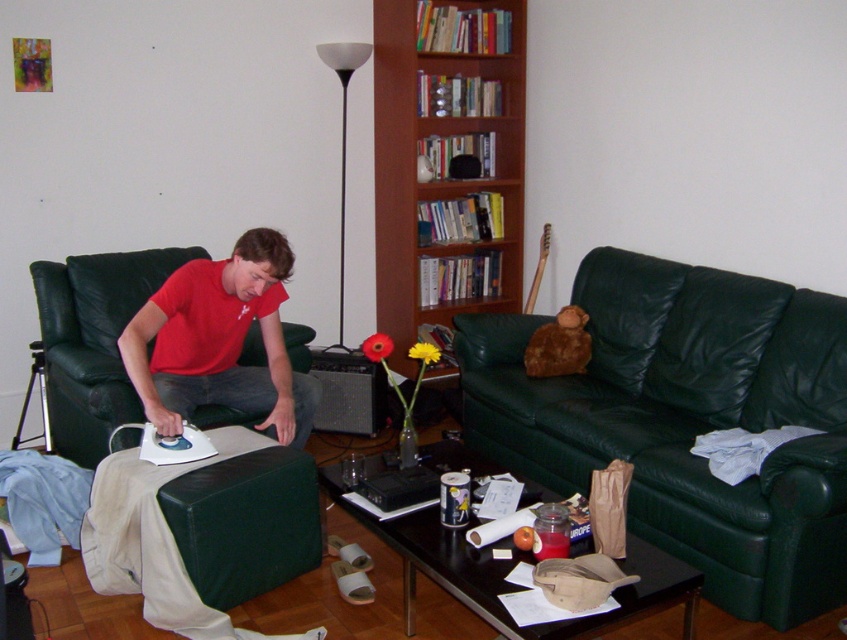
Based on the photo, does green leather couch at center appear over matte red shirt at center?

No.

Between green leather couch at center and matte red shirt at center, which one is positioned lower?

green leather couch at center is lower down.

Where is `green leather couch at center`? The image size is (847, 640). green leather couch at center is located at coordinates (685, 420).

Where is `green leather couch at center`? The height and width of the screenshot is (640, 847). green leather couch at center is located at coordinates (685, 420).

What do you see at coordinates (685, 420) in the screenshot?
I see `green leather couch at center` at bounding box center [685, 420].

Does green leather couch at center lie in front of wooden bookshelf at center?

That is True.

At what (x,y) coordinates should I click in order to perform the action: click on green leather couch at center. Please return your answer as a coordinate pair (x, y). This screenshot has height=640, width=847. Looking at the image, I should click on (x=685, y=420).

Does wooden bookshelf at center have a smaller size compared to matte red shirt at center?

No.

Is wooden bookshelf at center below matte red shirt at center?

No.

Does point (405, 182) come behind point (134, 365)?

Yes, point (405, 182) is farther from viewer.

Find the location of a particular element. This screenshot has width=847, height=640. wooden bookshelf at center is located at coordinates (439, 179).